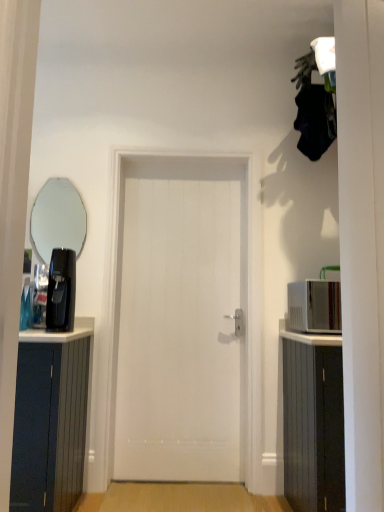
Question: Considering the relative sizes of white smooth door at center and black plastic coffee machine at left in the image provided, is white smooth door at center smaller than black plastic coffee machine at left?

Choices:
 (A) no
 (B) yes

Answer: (A)

Question: Is white smooth door at center oriented towards black plastic coffee machine at left?

Choices:
 (A) no
 (B) yes

Answer: (A)

Question: Is white smooth door at center closer to camera compared to black plastic coffee machine at left?

Choices:
 (A) no
 (B) yes

Answer: (A)

Question: Is white smooth door at center further to the viewer compared to black plastic coffee machine at left?

Choices:
 (A) no
 (B) yes

Answer: (B)

Question: Can you confirm if white smooth door at center is thinner than black plastic coffee machine at left?

Choices:
 (A) yes
 (B) no

Answer: (A)

Question: From a real-world perspective, is white smooth door at center under black plastic coffee machine at left?

Choices:
 (A) yes
 (B) no

Answer: (A)

Question: Would you say white glossy microwave at right is a long distance from white smooth door at center?

Choices:
 (A) yes
 (B) no

Answer: (B)

Question: From the image's perspective, is white glossy microwave at right over white smooth door at center?

Choices:
 (A) no
 (B) yes

Answer: (B)

Question: From a real-world perspective, does white glossy microwave at right stand above white smooth door at center?

Choices:
 (A) yes
 (B) no

Answer: (A)

Question: Does white glossy microwave at right have a smaller size compared to white smooth door at center?

Choices:
 (A) no
 (B) yes

Answer: (B)

Question: Considering the relative sizes of white glossy microwave at right and white smooth door at center in the image provided, is white glossy microwave at right taller than white smooth door at center?

Choices:
 (A) no
 (B) yes

Answer: (A)

Question: Is white glossy microwave at right positioned with its back to white smooth door at center?

Choices:
 (A) no
 (B) yes

Answer: (A)

Question: From the image's perspective, is black plastic coffee machine at left above white smooth door at center?

Choices:
 (A) no
 (B) yes

Answer: (B)